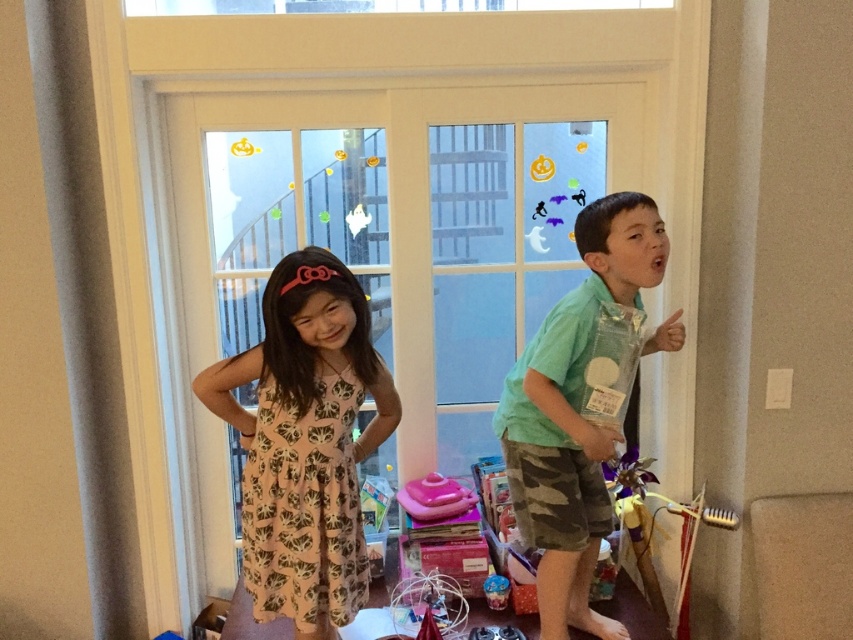
Is point (322, 269) farther from camera compared to point (659, 244)?

No, (322, 269) is closer to viewer.

Find the location of `pink fabric dress at center`. pink fabric dress at center is located at coordinates (305, 442).

Does point (308, 532) come in front of point (627, 218)?

That is True.

I want to click on pink fabric dress at center, so [305, 442].

Which of these two, pink fabric dress at center or pink plastic toy at center, stands shorter?

pink plastic toy at center is shorter.

The width and height of the screenshot is (853, 640). What do you see at coordinates (305, 442) in the screenshot?
I see `pink fabric dress at center` at bounding box center [305, 442].

Measure the distance between pink fabric dress at center and camera.

1.78 meters

Locate an element on the screen. The width and height of the screenshot is (853, 640). pink fabric dress at center is located at coordinates (305, 442).

Consider the image. Between green cotton shirt at right and pink plastic toy at center, which one is positioned higher?

green cotton shirt at right

Can you confirm if green cotton shirt at right is smaller than pink plastic toy at center?

No.

Consider the image. Who is more forward, [625,230] or [460,492]?

Point [625,230] is in front.

Identify the location of green cotton shirt at right. (573, 413).